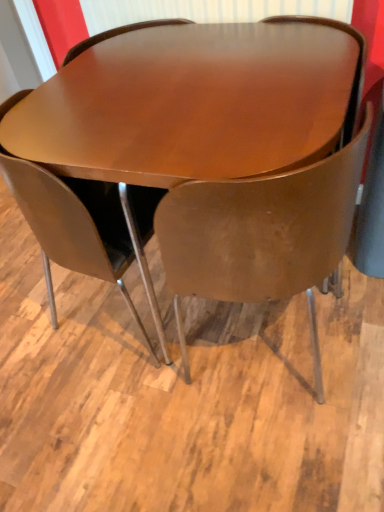
Locate an element on the screen. The width and height of the screenshot is (384, 512). vacant area on top of glossy wood table at center (from a real-world perspective) is located at coordinates (179, 79).